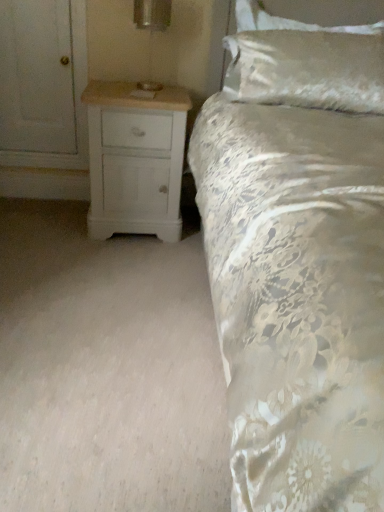
Question: Does metallic silver table lamp at upper center appear on the right side of white wood chest of drawers at lower left?

Choices:
 (A) yes
 (B) no

Answer: (A)

Question: From the image's perspective, is metallic silver table lamp at upper center on top of white wood chest of drawers at lower left?

Choices:
 (A) no
 (B) yes

Answer: (B)

Question: Can you confirm if metallic silver table lamp at upper center is positioned to the left of white wood chest of drawers at lower left?

Choices:
 (A) yes
 (B) no

Answer: (B)

Question: Is there a large distance between metallic silver table lamp at upper center and white wood chest of drawers at lower left?

Choices:
 (A) yes
 (B) no

Answer: (B)

Question: Is metallic silver table lamp at upper center touching white wood chest of drawers at lower left?

Choices:
 (A) no
 (B) yes

Answer: (A)

Question: Considering the relative sizes of metallic silver table lamp at upper center and white wood chest of drawers at lower left in the image provided, is metallic silver table lamp at upper center thinner than white wood chest of drawers at lower left?

Choices:
 (A) yes
 (B) no

Answer: (A)

Question: Is white wood chest of drawers at lower left surrounding silky white pillow at upper right?

Choices:
 (A) yes
 (B) no

Answer: (B)

Question: From the image's perspective, is white wood chest of drawers at lower left beneath silky white pillow at upper right?

Choices:
 (A) yes
 (B) no

Answer: (A)

Question: Is white wood chest of drawers at lower left shorter than silky white pillow at upper right?

Choices:
 (A) yes
 (B) no

Answer: (B)

Question: Could you tell me if white wood chest of drawers at lower left is turned towards silky white pillow at upper right?

Choices:
 (A) yes
 (B) no

Answer: (B)

Question: Does white wood chest of drawers at lower left come behind silky white pillow at upper right?

Choices:
 (A) yes
 (B) no

Answer: (B)

Question: Considering the relative sizes of white wood chest of drawers at lower left and silky white pillow at upper right in the image provided, is white wood chest of drawers at lower left smaller than silky white pillow at upper right?

Choices:
 (A) no
 (B) yes

Answer: (A)

Question: Considering the relative sizes of silky white pillow at upper right and white wood chest of drawers at lower left in the image provided, is silky white pillow at upper right shorter than white wood chest of drawers at lower left?

Choices:
 (A) no
 (B) yes

Answer: (B)